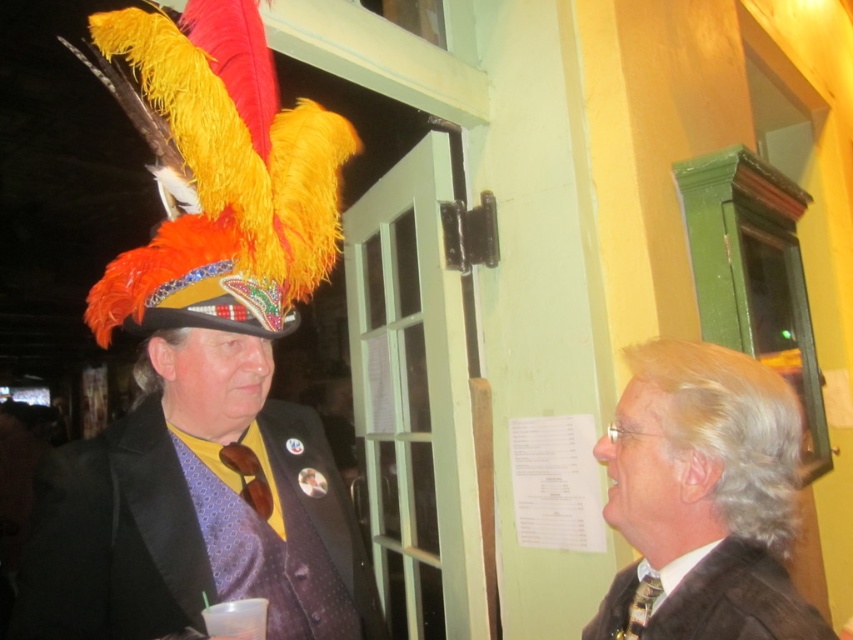
You are a photographer standing at point (x=308, y=220). You want to take a photo of both individuals to ensure they are in focus. The camera you are using has a depth of field that can sharply focus on subjects within a 1.0 meter range. Can you capture both individuals in sharp focus with your current position?

The two individuals are 1.11 meters apart. Since the depth of field can only cover 1.0 meter, the distance between them exceeds the camera s capability. Therefore, it would be challenging to have both in sharp focus simultaneously.

You are at a formal event and need to locate the matte black suit at right and the dark brown fabric business suit at right. According to the image, which one is positioned to the right of the other?

The matte black suit at right is positioned to the right of the dark brown fabric business suit at right.

You are a tailor measuring suits for alterations. You need to determine which suit requires a longer hem. Which one is taller between the matte black suit at right and the dark brown fabric business suit at right?

The matte black suit at right is taller than the dark brown fabric business suit at right, so the matte black suit at right requires a longer hem.